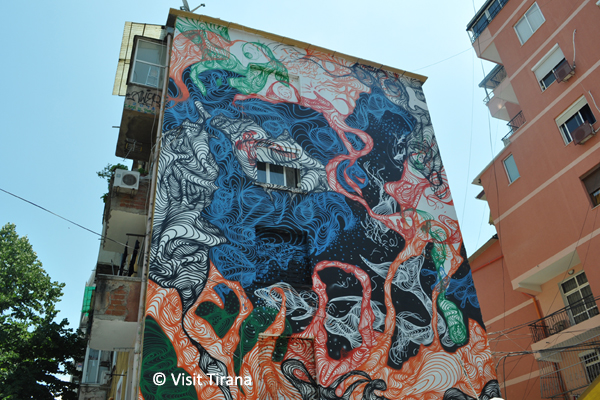
You are a GUI agent. You are given a task and a screenshot of the screen. Output one action in this format:
    pyautogui.click(x=<x>, y=<y>)
    Task: Click on the mural
    The width and height of the screenshot is (600, 400).
    Given the screenshot: What is the action you would take?
    pyautogui.click(x=360, y=247)